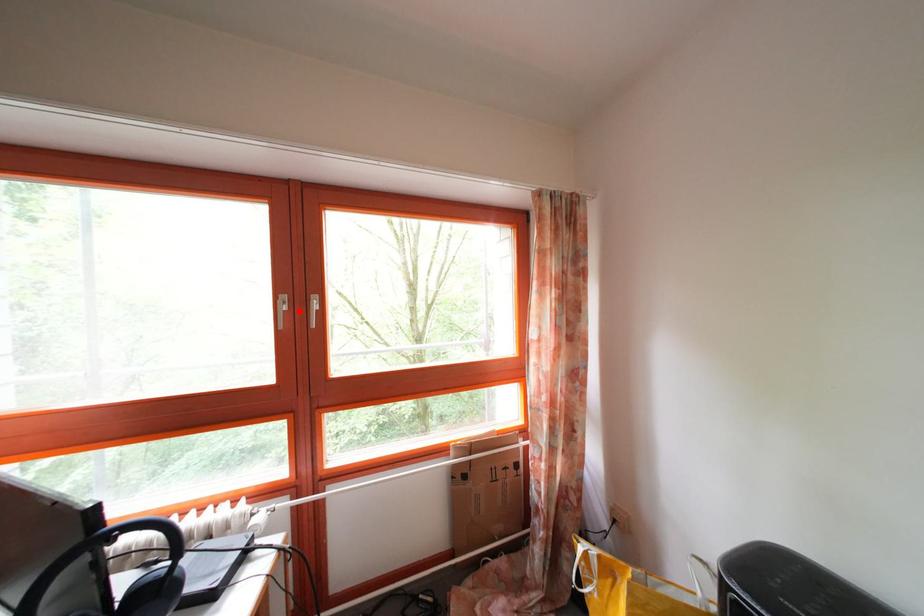
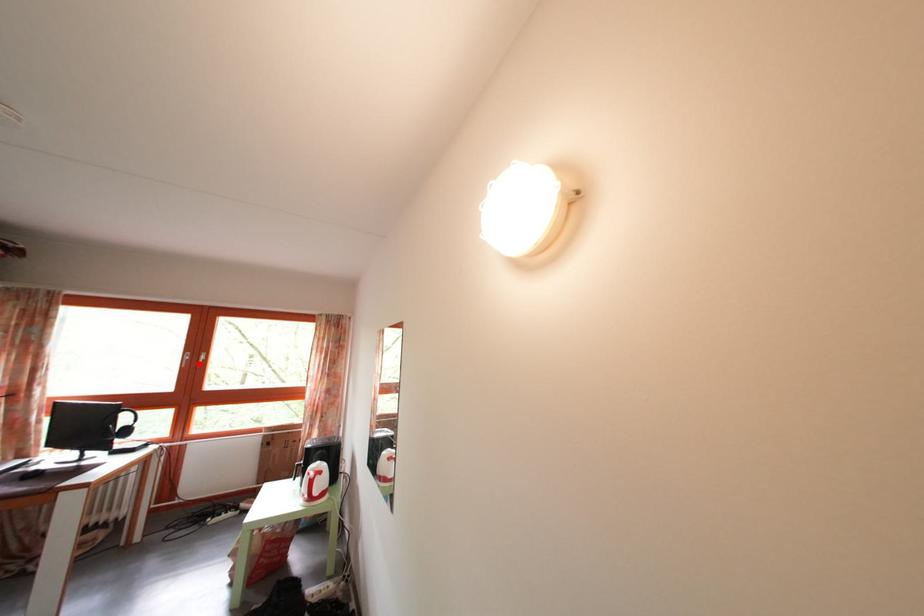
I am providing you with two images of the same scene from different viewpoints. A red point is marked on the first image and another point is marked on the second image. Are the points marked in image1 and image2 representing the same 3D position?

Yes